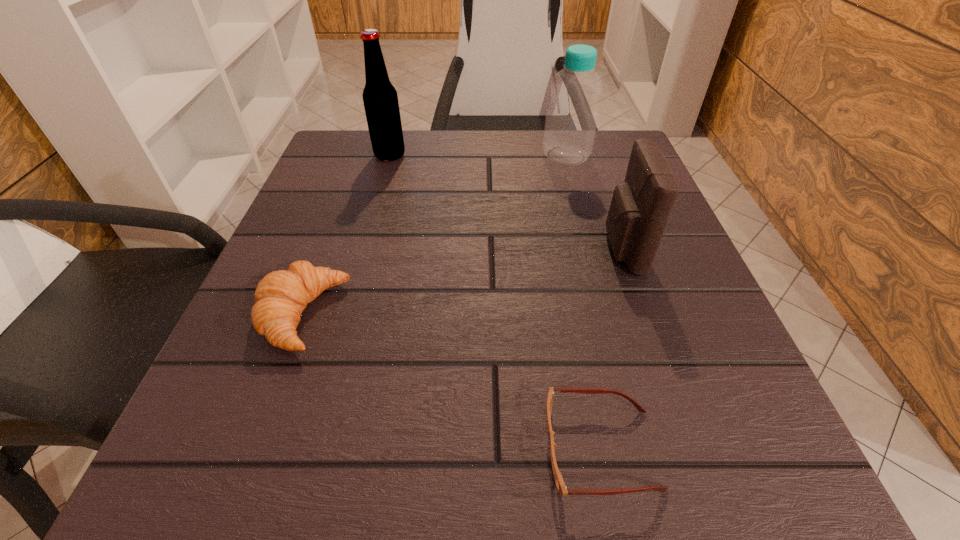
In the image, there is a desktop. Identify the location of vacant area at the far left corner. The width and height of the screenshot is (960, 540). (375, 164).

I want to click on vacant space at the near left corner, so click(x=267, y=430).

Locate an element on the screen. This screenshot has height=540, width=960. free location at the far right corner is located at coordinates (619, 132).

Image resolution: width=960 pixels, height=540 pixels. I want to click on free space that is in between the third shortest object and the bottle, so click(594, 202).

Find the location of a particular element. The width and height of the screenshot is (960, 540). free point between the nearest object and the beer bottle is located at coordinates (495, 302).

At what (x,y) coordinates should I click in order to perform the action: click on vacant area that lies between the shortest object and the pouch. Please return your answer as a coordinate pair (x, y). Image resolution: width=960 pixels, height=540 pixels. Looking at the image, I should click on (612, 349).

This screenshot has width=960, height=540. In order to click on free space that is in between the beer bottle and the spectacles in this screenshot , I will do `click(495, 302)`.

Locate an element on the screen. vacant space in between the nearest object and the bottle is located at coordinates [584, 302].

Find the location of a particular element. vacant point located between the nearest object and the crescent roll is located at coordinates (451, 382).

The width and height of the screenshot is (960, 540). I want to click on free space between the pouch and the beer bottle, so click(x=506, y=202).